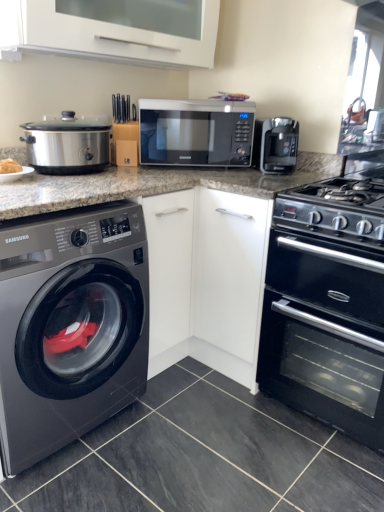
Question: From a real-world perspective, is satin silver microwave at center positioned over black matte oven at lower right based on gravity?

Choices:
 (A) no
 (B) yes

Answer: (B)

Question: Is satin silver microwave at center thinner than black matte oven at lower right?

Choices:
 (A) yes
 (B) no

Answer: (A)

Question: Can you confirm if satin silver microwave at center is wider than black matte oven at lower right?

Choices:
 (A) no
 (B) yes

Answer: (A)

Question: Considering the relative positions of satin silver microwave at center and black matte oven at lower right in the image provided, is satin silver microwave at center to the right of black matte oven at lower right from the viewer's perspective?

Choices:
 (A) yes
 (B) no

Answer: (B)

Question: Is the surface of satin silver microwave at center in direct contact with black matte oven at lower right?

Choices:
 (A) yes
 (B) no

Answer: (B)

Question: Is satin silver microwave at center far from black matte oven at lower right?

Choices:
 (A) no
 (B) yes

Answer: (A)

Question: Does black matte oven at lower right come behind satin black washing machine at left?

Choices:
 (A) yes
 (B) no

Answer: (A)

Question: Is satin black washing machine at left located within black matte oven at lower right?

Choices:
 (A) no
 (B) yes

Answer: (A)

Question: Is black matte oven at lower right completely or partially outside of satin black washing machine at left?

Choices:
 (A) no
 (B) yes

Answer: (B)

Question: Is black matte oven at lower right at the left side of satin black washing machine at left?

Choices:
 (A) yes
 (B) no

Answer: (B)

Question: Does black matte oven at lower right turn towards satin black washing machine at left?

Choices:
 (A) no
 (B) yes

Answer: (A)

Question: Can you confirm if black matte oven at lower right is thinner than satin black washing machine at left?

Choices:
 (A) yes
 (B) no

Answer: (B)

Question: Could satin black washing machine at left be considered to be inside satin silver microwave at center?

Choices:
 (A) no
 (B) yes

Answer: (A)